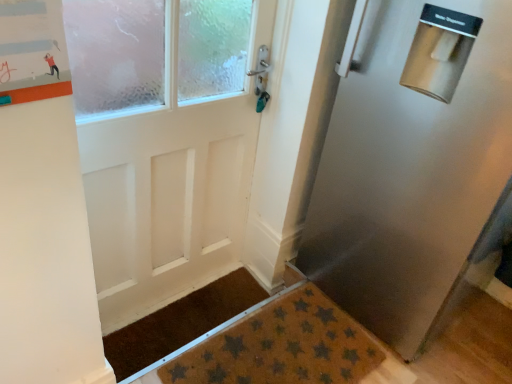
Question: Is brown textured mat at lower center, acting as the 2th doormat starting from the front, smaller than brown textured doormat at lower center, which appears as the second doormat when viewed from the back?

Choices:
 (A) yes
 (B) no

Answer: (A)

Question: Is brown textured mat at lower center, which appears as the 1th doormat when viewed from the back, closer to camera compared to brown textured doormat at lower center, which appears as the second doormat when viewed from the back?

Choices:
 (A) yes
 (B) no

Answer: (B)

Question: Considering the relative sizes of brown textured mat at lower center, acting as the 2th doormat starting from the front, and brown textured doormat at lower center, which appears as the second doormat when viewed from the back, in the image provided, is brown textured mat at lower center, acting as the 2th doormat starting from the front, thinner than brown textured doormat at lower center, which appears as the second doormat when viewed from the back,?

Choices:
 (A) yes
 (B) no

Answer: (A)

Question: Is brown textured doormat at lower center, which appears as the first doormat when viewed from the front, completely or partially inside brown textured mat at lower center, acting as the 2th doormat starting from the front?

Choices:
 (A) no
 (B) yes

Answer: (A)

Question: Does brown textured mat at lower center, which appears as the 1th doormat when viewed from the back, turn towards brown textured doormat at lower center, which appears as the second doormat when viewed from the back?

Choices:
 (A) yes
 (B) no

Answer: (B)

Question: From a real-world perspective, is orange matte bulletin board at upper left above or below brown textured mat at lower center, which appears as the 1th doormat when viewed from the back?

Choices:
 (A) below
 (B) above

Answer: (B)

Question: Considering the positions of orange matte bulletin board at upper left and brown textured mat at lower center, acting as the 2th doormat starting from the front, in the image, is orange matte bulletin board at upper left wider or thinner than brown textured mat at lower center, acting as the 2th doormat starting from the front,?

Choices:
 (A) wide
 (B) thin

Answer: (B)

Question: From the image's perspective, is orange matte bulletin board at upper left positioned above or below brown textured mat at lower center, which appears as the 1th doormat when viewed from the back?

Choices:
 (A) above
 (B) below

Answer: (A)

Question: Is orange matte bulletin board at upper left inside or outside of brown textured mat at lower center, acting as the 2th doormat starting from the front?

Choices:
 (A) outside
 (B) inside

Answer: (A)

Question: From the image's perspective, is orange matte bulletin board at upper left located above or below stainless steel refrigerator at right?

Choices:
 (A) below
 (B) above

Answer: (B)

Question: Is point (16, 46) closer or farther from the camera than point (352, 304)?

Choices:
 (A) closer
 (B) farther

Answer: (A)

Question: Is orange matte bulletin board at upper left in front of or behind stainless steel refrigerator at right in the image?

Choices:
 (A) front
 (B) behind

Answer: (A)

Question: Based on their positions, is orange matte bulletin board at upper left located to the left or right of stainless steel refrigerator at right?

Choices:
 (A) left
 (B) right

Answer: (A)

Question: Looking at their shapes, would you say brown textured doormat at lower center, which appears as the first doormat when viewed from the front, is wider or thinner than stainless steel refrigerator at right?

Choices:
 (A) wide
 (B) thin

Answer: (B)

Question: Considering the positions of brown textured doormat at lower center, which appears as the first doormat when viewed from the front, and stainless steel refrigerator at right in the image, is brown textured doormat at lower center, which appears as the first doormat when viewed from the front, taller or shorter than stainless steel refrigerator at right?

Choices:
 (A) short
 (B) tall

Answer: (A)